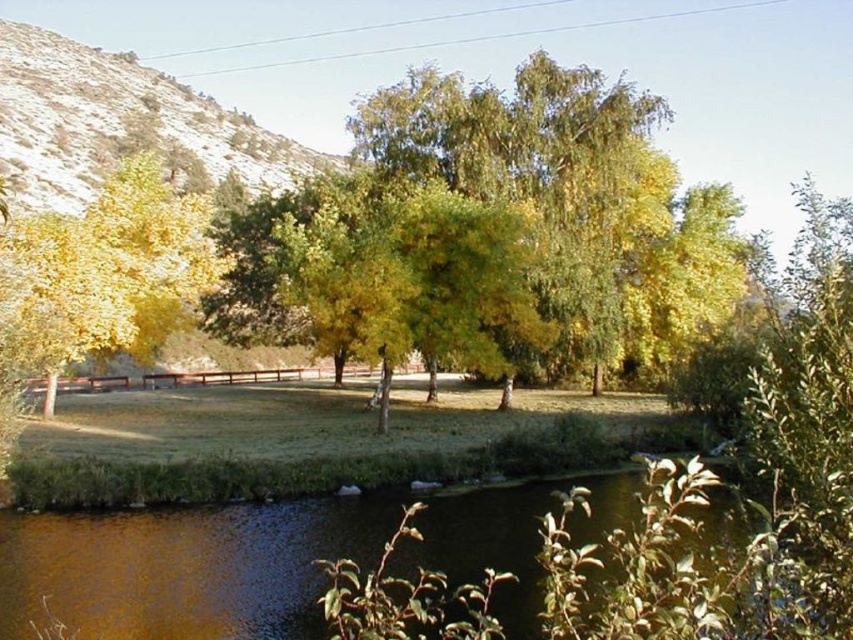
You are standing in the autumn landscape and see the brown liquid water at lower center and the yellow leafy tree at left. Which object is positioned to the right of the other?

The brown liquid water at lower center is positioned to the right of the yellow leafy tree at left.

You are standing at the edge of the brown liquid water at lower center and want to walk to the yellow leafy tree at left. Which direction should you face to move towards it?

You should face away from the yellow leafy tree at left because the brown liquid water at lower center is in front of it, meaning the tree is behind you.

You are an artist planning to paint the scene. You want to ensure that the brown liquid water at lower center and the yellow leafy tree at left are proportionally accurate. Which object should you paint first to maintain the correct size relationship between them?

You should paint the yellow leafy tree at left first because the brown liquid water at lower center occupies less space than it, meaning the tree is larger and should be outlined first to ensure proper scaling.